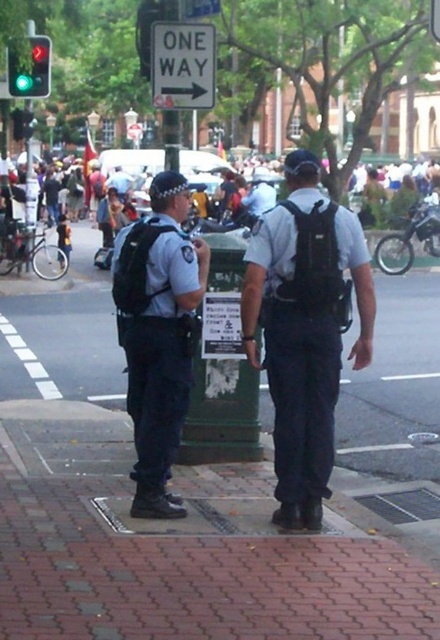
Between matte black uniform at center and white plastic one way sign at upper center, which one is positioned higher?

white plastic one way sign at upper center is higher up.

I want to click on matte black uniform at center, so click(x=157, y=333).

The image size is (440, 640). What are the coordinates of `matte black uniform at center` in the screenshot? It's located at (157, 333).

Find the location of `dark blue uniform at center`. dark blue uniform at center is located at coordinates (304, 330).

Who is higher up, dark blue uniform at center or white plastic sign at upper center?

white plastic sign at upper center

You are a GUI agent. You are given a task and a screenshot of the screen. Output one action in this format:
    pyautogui.click(x=<x>, y=<y>)
    Task: Click on the dark blue uniform at center
    Image resolution: width=440 pixels, height=640 pixels.
    Given the screenshot: What is the action you would take?
    pyautogui.click(x=304, y=330)

Which is behind, point (151, 272) or point (41, 48)?

The point (41, 48) is more distant.

Who is positioned more to the left, matte black uniform at center or green glass traffic light at upper left?

green glass traffic light at upper left

Is point (142, 477) positioned in front of point (37, 35)?

Yes, point (142, 477) is closer to viewer.

You are a GUI agent. You are given a task and a screenshot of the screen. Output one action in this format:
    pyautogui.click(x=<x>, y=<y>)
    Task: Click on the matte black uniform at center
    
    Given the screenshot: What is the action you would take?
    pyautogui.click(x=157, y=333)